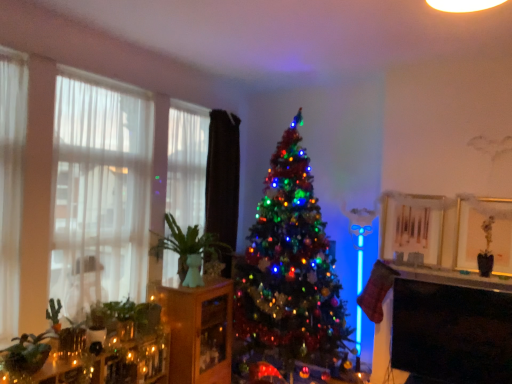
Question: Is green ceramic vase at left wider than black glossy tv at lower right?

Choices:
 (A) no
 (B) yes

Answer: (B)

Question: Is green ceramic vase at left at the right side of black glossy tv at lower right?

Choices:
 (A) yes
 (B) no

Answer: (B)

Question: Is green ceramic vase at left at the left side of black glossy tv at lower right?

Choices:
 (A) yes
 (B) no

Answer: (A)

Question: Are green ceramic vase at left and black glossy tv at lower right far apart?

Choices:
 (A) no
 (B) yes

Answer: (B)

Question: Does green ceramic vase at left have a lesser width compared to black glossy tv at lower right?

Choices:
 (A) no
 (B) yes

Answer: (A)

Question: In the image, is white sheer curtain at left, acting as the first curtain starting from the left, on the left side or the right side of black velvet curtain at center, positioned as the first curtain in right-to-left order?

Choices:
 (A) right
 (B) left

Answer: (B)

Question: From the image's perspective, is white sheer curtain at left, acting as the first curtain starting from the left, above or below black velvet curtain at center, the 2th curtain viewed from the left?

Choices:
 (A) above
 (B) below

Answer: (A)

Question: Would you say white sheer curtain at left, which appears as the 2th curtain when viewed from the right, is inside or outside black velvet curtain at center, positioned as the first curtain in right-to-left order?

Choices:
 (A) outside
 (B) inside

Answer: (A)

Question: From their relative heights in the image, would you say white sheer curtain at left, acting as the first curtain starting from the left, is taller or shorter than black velvet curtain at center, positioned as the first curtain in right-to-left order?

Choices:
 (A) tall
 (B) short

Answer: (B)

Question: Considering the positions of point (217, 372) and point (196, 248), is point (217, 372) closer or farther from the camera than point (196, 248)?

Choices:
 (A) farther
 (B) closer

Answer: (A)

Question: Choose the correct answer: Is wooden cabinet at center inside green ceramic vase at left or outside it?

Choices:
 (A) inside
 (B) outside

Answer: (B)

Question: Is wooden cabinet at center taller or shorter than green ceramic vase at left?

Choices:
 (A) tall
 (B) short

Answer: (A)

Question: In terms of size, does wooden cabinet at center appear bigger or smaller than green ceramic vase at left?

Choices:
 (A) big
 (B) small

Answer: (A)

Question: From their relative heights in the image, would you say matte white shelf at lower right is taller or shorter than matte glass candle at lower left?

Choices:
 (A) short
 (B) tall

Answer: (A)

Question: Looking at their shapes, would you say matte white shelf at lower right is wider or thinner than matte glass candle at lower left?

Choices:
 (A) thin
 (B) wide

Answer: (B)